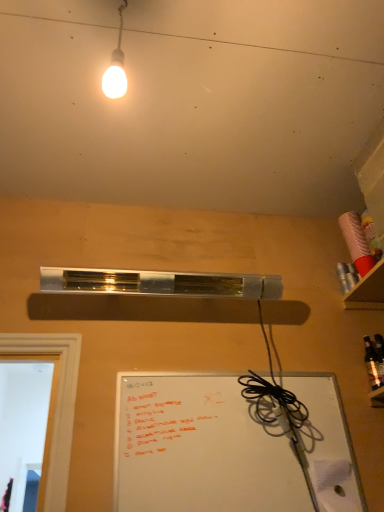
The image size is (384, 512). Find the location of `whiteboard at lower right`. whiteboard at lower right is located at coordinates (201, 448).

The height and width of the screenshot is (512, 384). Identify the location of shiny dark glass bottle at right. (373, 364).

Where is `whiteboard at lower right`? This screenshot has height=512, width=384. whiteboard at lower right is located at coordinates (201, 448).

From the image's perspective, between cardboard shelf at upper right and matte white bulb at upper center, who is located below?

cardboard shelf at upper right appears lower in the image.

Locate an element on the screen. The height and width of the screenshot is (512, 384). shelf behind the matte white bulb at upper center is located at coordinates pyautogui.click(x=367, y=291).

Could you tell me if cardboard shelf at upper right is turned towards matte white bulb at upper center?

No, cardboard shelf at upper right is not oriented towards matte white bulb at upper center.

Consider the image. Which is correct: cardboard shelf at upper right is inside matte white bulb at upper center, or outside of it?

The correct answer is: outside.

Is cardboard shelf at upper right directly adjacent to shiny dark glass bottle at right?

Answer: There is a gap between cardboard shelf at upper right and shiny dark glass bottle at right.

Find the location of a particular element. This screenshot has width=384, height=512. bottle below the cardboard shelf at upper right (from the image's perspective) is located at coordinates (373, 364).

From the image's perspective, who appears lower, shiny dark glass bottle at right or cardboard shelf at upper right?

shiny dark glass bottle at right, from the image's perspective.

Between point (370, 346) and point (361, 280), which one is positioned behind?

Positioned behind is point (361, 280).

From a real-world perspective, between shiny dark glass bottle at right and cardboard shelf at upper right, who is vertically higher?

cardboard shelf at upper right.

Which is more to the right, shiny dark glass bottle at right or cardboard shelf at upper right?

From the viewer's perspective, cardboard shelf at upper right appears more on the right side.

Which is more to the right, matte white bulb at upper center or whiteboard at lower right?

From the viewer's perspective, whiteboard at lower right appears more on the right side.

From a real-world perspective, which object rests below the other?

From a 3D spatial view, whiteboard at lower right is below.

Which object is wider, matte white bulb at upper center or whiteboard at lower right?

matte white bulb at upper center.

Which of these two, shiny dark glass bottle at right or matte white bulb at upper center, stands taller?

matte white bulb at upper center.

Is shiny dark glass bottle at right aimed at matte white bulb at upper center?

No.

Is shiny dark glass bottle at right wider than matte white bulb at upper center?

In fact, shiny dark glass bottle at right might be narrower than matte white bulb at upper center.

Would you say shiny dark glass bottle at right is a long distance from matte white bulb at upper center?

Yes, shiny dark glass bottle at right and matte white bulb at upper center are quite far apart.

Is whiteboard at lower right oriented away from matte white bulb at upper center?

whiteboard at lower right does not have its back to matte white bulb at upper center.

Would you consider whiteboard at lower right to be distant from matte white bulb at upper center?

Yes, whiteboard at lower right and matte white bulb at upper center are located far from each other.

Locate an element on the screen. This screenshot has height=512, width=384. lamp in front of the whiteboard at lower right is located at coordinates (116, 66).

In terms of height, does whiteboard at lower right look taller or shorter compared to matte white bulb at upper center?

In the image, whiteboard at lower right appears to be shorter than matte white bulb at upper center.

Can you confirm if shiny dark glass bottle at right is taller than whiteboard at lower right?

No, shiny dark glass bottle at right is not taller than whiteboard at lower right.

Is shiny dark glass bottle at right positioned in front of whiteboard at lower right?

No, shiny dark glass bottle at right is further to the viewer.

The width and height of the screenshot is (384, 512). Find the location of `shelf behind the matte white bulb at upper center`. shelf behind the matte white bulb at upper center is located at coordinates (367, 291).

Find the location of `shelf that appears on the right of shiny dark glass bottle at right`. shelf that appears on the right of shiny dark glass bottle at right is located at coordinates (367, 291).

Looking at this image, looking at the image, which one is located further to whiteboard at lower right, shiny dark glass bottle at right or cardboard shelf at upper right?

cardboard shelf at upper right lies further to whiteboard at lower right than the other object.

Consider the image. Estimate the real-world distances between objects in this image. Which object is further from shiny dark glass bottle at right, matte white bulb at upper center or cardboard shelf at upper right?

Among the two, matte white bulb at upper center is located further to shiny dark glass bottle at right.

Considering their positions, is matte white bulb at upper center positioned further to shiny dark glass bottle at right than whiteboard at lower right?

matte white bulb at upper center is positioned further to the anchor shiny dark glass bottle at right.

Consider the image. When comparing their distances from matte white bulb at upper center, does whiteboard at lower right or cardboard shelf at upper right seem further?

cardboard shelf at upper right is further to matte white bulb at upper center.

Considering their positions, is whiteboard at lower right positioned closer to cardboard shelf at upper right than shiny dark glass bottle at right?

Among the two, shiny dark glass bottle at right is located nearer to cardboard shelf at upper right.

From the image, which object appears to be nearer to whiteboard at lower right, cardboard shelf at upper right or shiny dark glass bottle at right?

Among the two, shiny dark glass bottle at right is located nearer to whiteboard at lower right.

Based on their spatial positions, is shiny dark glass bottle at right or matte white bulb at upper center closer to cardboard shelf at upper right?

Among the two, shiny dark glass bottle at right is located nearer to cardboard shelf at upper right.

Looking at the image, which one is located further to whiteboard at lower right, matte white bulb at upper center or cardboard shelf at upper right?

Among the two, matte white bulb at upper center is located further to whiteboard at lower right.

This screenshot has width=384, height=512. In order to click on bottle between matte white bulb at upper center and whiteboard at lower right vertically in this screenshot , I will do `click(373, 364)`.

In order to click on bottle between whiteboard at lower right and cardboard shelf at upper right in this screenshot , I will do `click(373, 364)`.

Image resolution: width=384 pixels, height=512 pixels. I want to click on shelf between matte white bulb at upper center and whiteboard at lower right in the up-down direction, so click(367, 291).

The height and width of the screenshot is (512, 384). I want to click on bottle between matte white bulb at upper center and cardboard shelf at upper right from left to right, so click(373, 364).